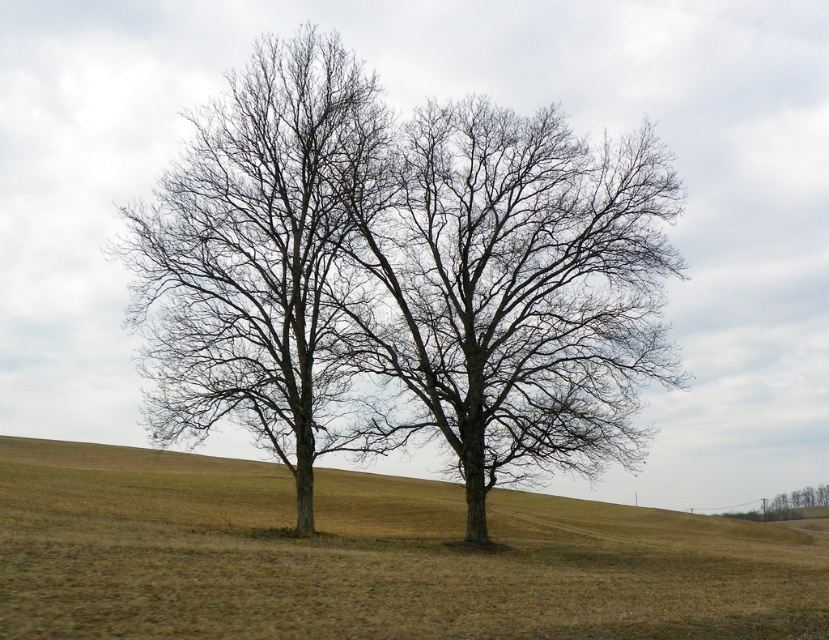
You are a hiker who wants to measure the distance between the two trees in the field. You have a measuring tape that can extend up to 20 meters. Can you determine if the distance between the bare wood tree at center and the brown leafless tree at lower right is within your tape measure range?

The distance between the bare wood tree at center and the brown leafless tree at lower right is 22.78 meters, which is beyond the 20 meters limit of your measuring tape. Therefore, you cannot measure the distance with your current tape measure.

You are standing in a field and see the bare wood tree at center. If you start walking directly towards it, how far will you have to walk to reach it?

You will have to walk 29.69 meters to reach the bare wood tree at center because it is 29.69 meters away from you.

Consider the image. You are a bird looking for a place to perch. You see the bare wood tree at center and the bare branches at center. Which one is lower to the ground?

The bare wood tree at center is lower to the ground than the bare branches at center.